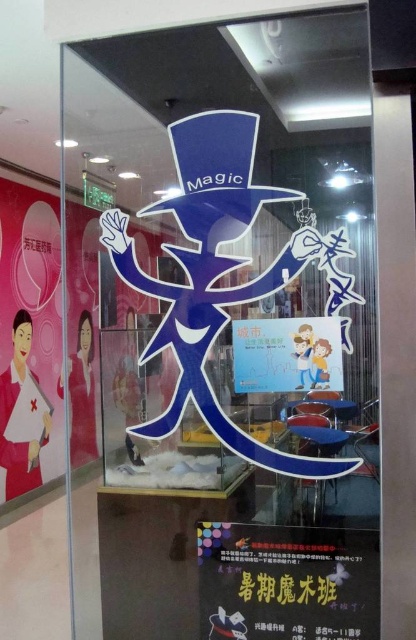
Question: Estimate the real-world distances between objects in this image. Which object is closer to the matte paper poster at center?

Choices:
 (A) matte pink poster at left
 (B) matte black poster at lower center
 (C) blue glossy magician at center

Answer: (C)

Question: Which point is closer to the camera?

Choices:
 (A) (190, 161)
 (B) (302, 380)
 (C) (322, 596)

Answer: (C)

Question: Which object is positioned farthest from the matte pink poster at left?

Choices:
 (A) matte black poster at lower center
 (B) matte paper poster at center
 (C) blue glossy magician at center

Answer: (B)

Question: Considering the relative positions of blue glossy magician at center and matte paper poster at center in the image provided, where is blue glossy magician at center located with respect to matte paper poster at center?

Choices:
 (A) below
 (B) above

Answer: (B)

Question: Is matte black poster at lower center to the right of matte paper poster at center from the viewer's perspective?

Choices:
 (A) no
 (B) yes

Answer: (A)

Question: Is matte black poster at lower center to the right of matte pink poster at left from the viewer's perspective?

Choices:
 (A) yes
 (B) no

Answer: (A)